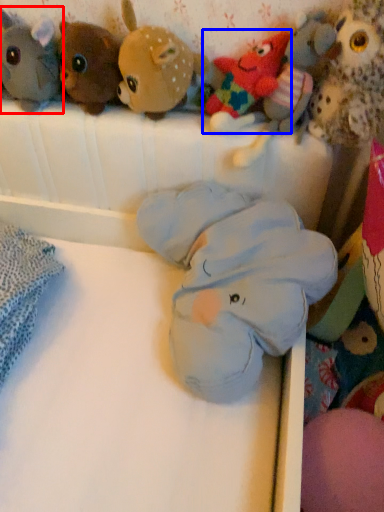
Question: Which object appears farthest to the camera in this image, toy (highlighted by a red box) or toy (highlighted by a blue box)?

Choices:
 (A) toy
 (B) toy

Answer: (A)